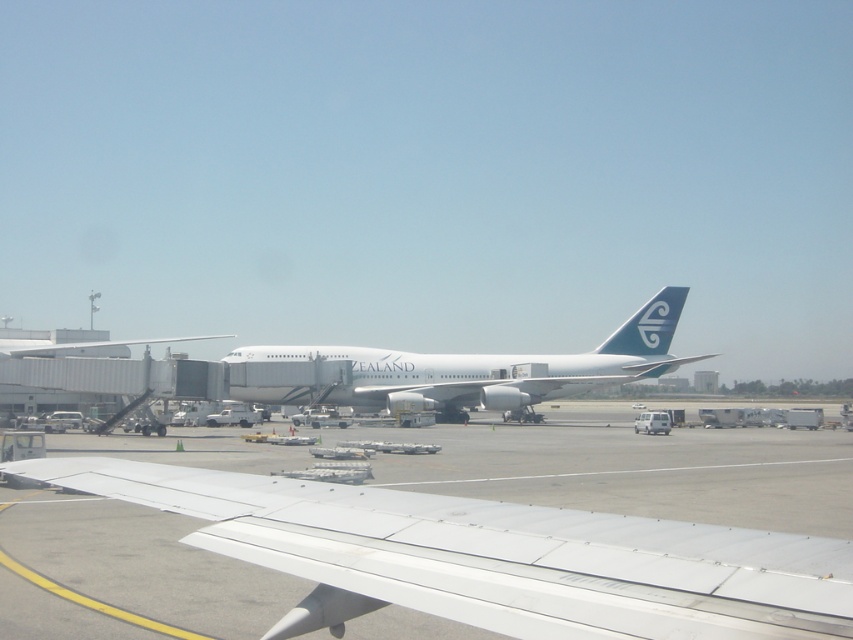
You are a passenger on an airplane and looking out the window. You see a white glossy airplane at center and a blue glossy tail at center right. Which object is closer to your current position?

The white glossy airplane at center is closer to your current position because it is located below the blue glossy tail at center right, indicating it is positioned in front of it.

You are a passenger sitting in an airplane seat and looking out the window. You see two points in the scene, one at point coordinates point (578, 561) and the other at point coordinates point (538, 376). Which point is closer to your view?

Point (578, 561) is closer to the viewer than point (538, 376).

You are a passenger sitting at seat 12A in an airplane. You look out the window and see a point marked at coordinates (490, 557). What object is this point located on?

The point at coordinates (490, 557) is located on the white matte wing at center.